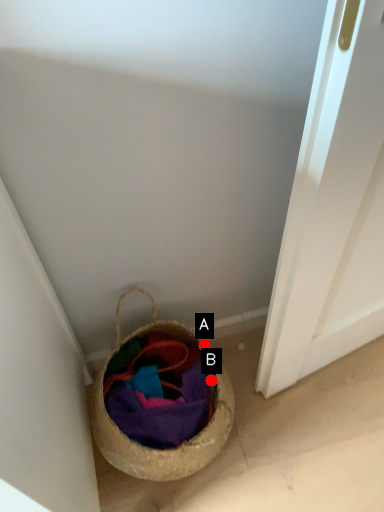
Question: Two points are circled on the image, labeled by A and B beside each circle. Which point is further to the camera?

Choices:
 (A) A is further
 (B) B is further

Answer: (A)